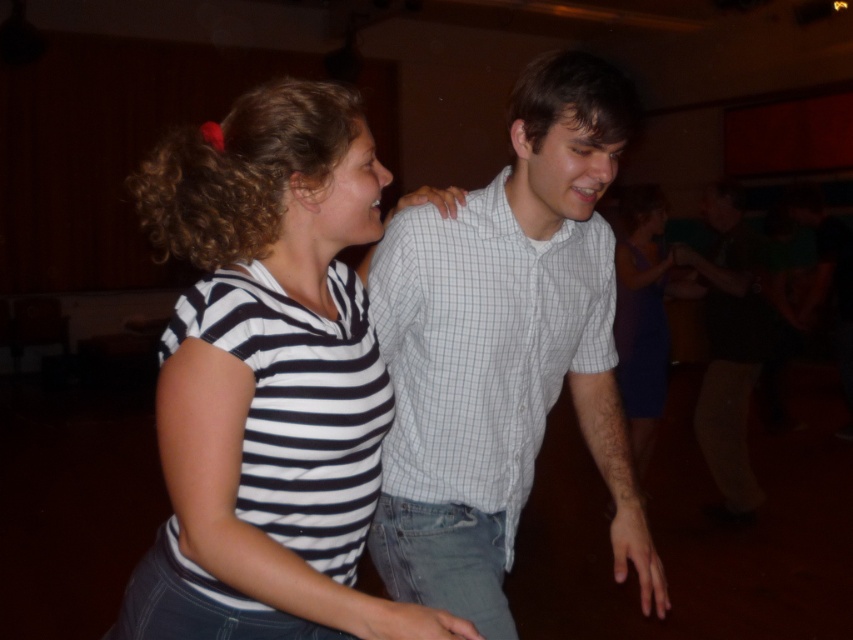
You are a photographer setting up a camera at the back of the room. You want to capture both the striped fabric shirt at center and the light blue checkered shirt at center in a single shot. Which person should you position closer to the camera to ensure both are fully visible?

The striped fabric shirt at center is shorter than the light blue checkered shirt at center. To ensure both are fully visible, position the striped fabric shirt at center closer to the camera so its height matches the taller light blue checkered shirt at center in the frame.